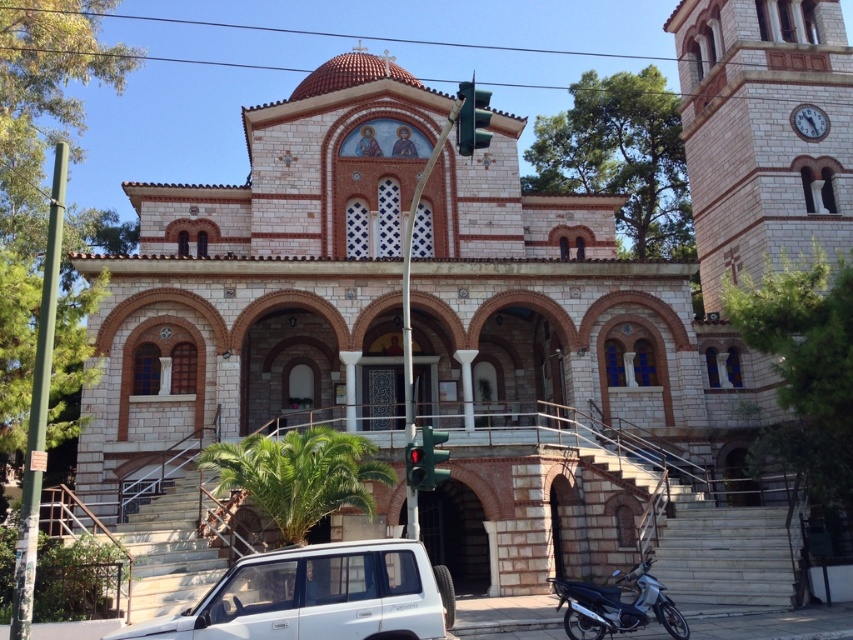
Locate an element on the screen. silver metallic motorcycle at lower right is located at coordinates [616, 605].

Does silver metallic motorcycle at lower right have a smaller size compared to green glass traffic light at center?

Indeed, silver metallic motorcycle at lower right has a smaller size compared to green glass traffic light at center.

Does point (646, 618) come behind point (462, 97)?

Yes, it is behind point (462, 97).

This screenshot has width=853, height=640. In order to click on silver metallic motorcycle at lower right in this screenshot , I will do `click(616, 605)`.

Can you confirm if white matte suv at lower center is wider than green glass traffic light at center?

Yes.

Looking at this image, is white matte suv at lower center below green glass traffic light at center?

Indeed, white matte suv at lower center is positioned under green glass traffic light at center.

Who is more distant from viewer, (260, 604) or (471, 83)?

Positioned behind is point (471, 83).

I want to click on white matte suv at lower center, so click(318, 596).

Is white matte suv at lower center positioned before silver metallic motorcycle at lower right?

Yes, it is.

Describe the element at coordinates (318, 596) in the screenshot. I see `white matte suv at lower center` at that location.

Locate an element on the screen. The image size is (853, 640). white matte suv at lower center is located at coordinates (318, 596).